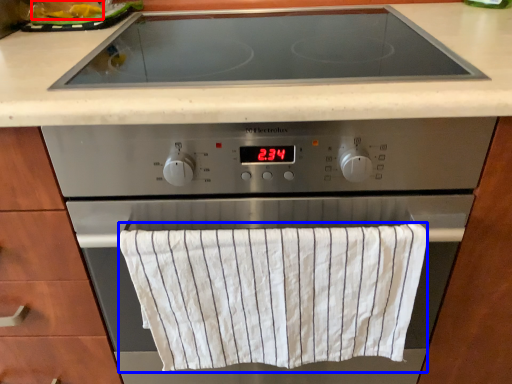
Question: Which object is closer to the camera taking this photo, food (highlighted by a red box) or bath towel (highlighted by a blue box)?

Choices:
 (A) food
 (B) bath towel

Answer: (B)